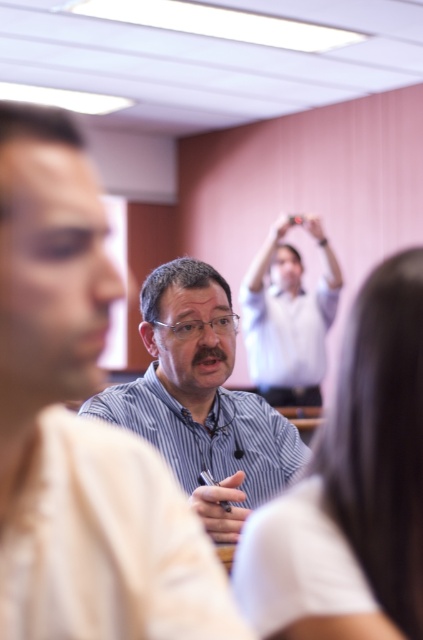
You are an attendee at the presentation and want to see both the striped shirt at center and the white matte hand at upper center clearly. Which one will appear larger to you?

The striped shirt at center will appear larger because it is closer to the viewer than the white matte hand at upper center.

You are a photographer trying to capture a clear shot of the striped shirt at center without the matte black hand at upper center blocking it. Based on the scene, can you adjust your position to achieve this?

The striped shirt at center is in front of the matte black hand at upper center, so moving your camera position slightly to the side might allow you to capture the striped shirt at center without the hand blocking it.